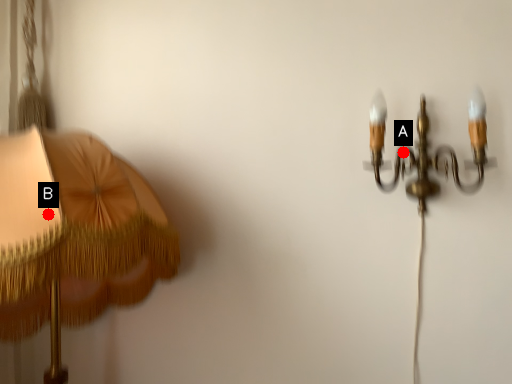
Question: Two points are circled on the image, labeled by A and B beside each circle. Which point appears farthest from the camera in this image?

Choices:
 (A) A is further
 (B) B is further

Answer: (A)